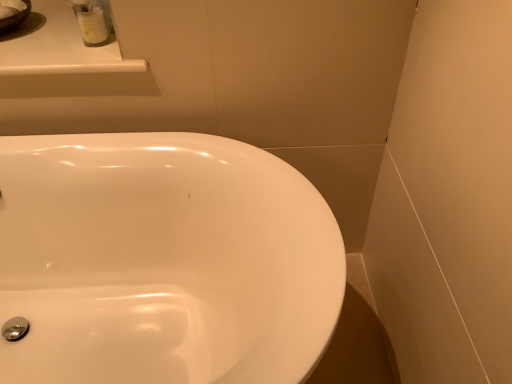
I want to click on blank space above white glossy counter top at upper left (from a real-world perspective), so click(x=51, y=34).